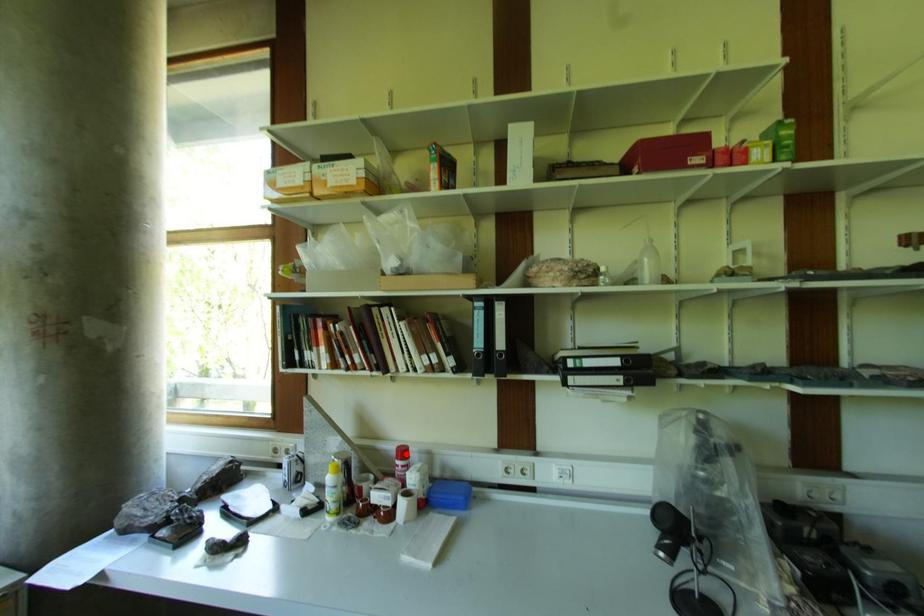
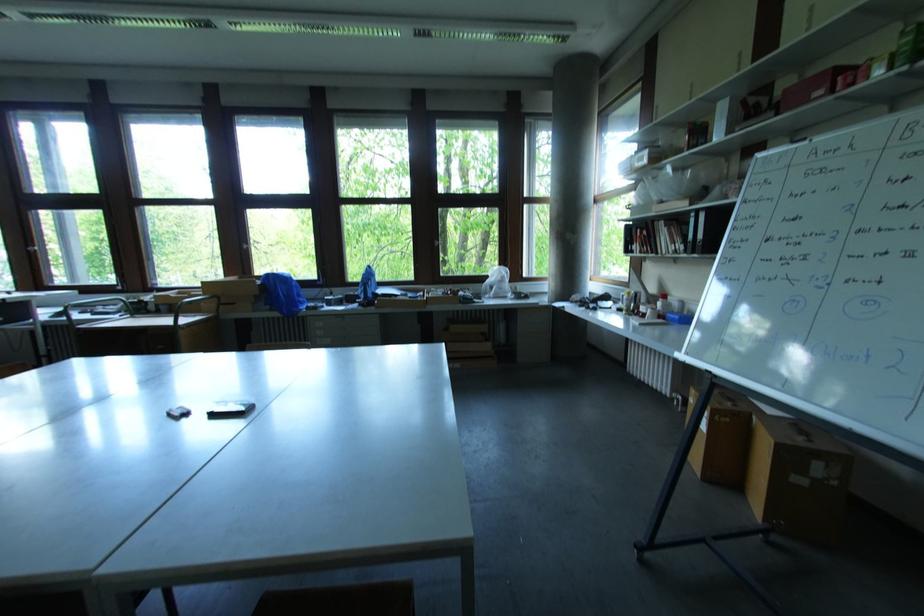
In the second image, find the point that corresponds to the highlighted location in the first image.

(667, 298)